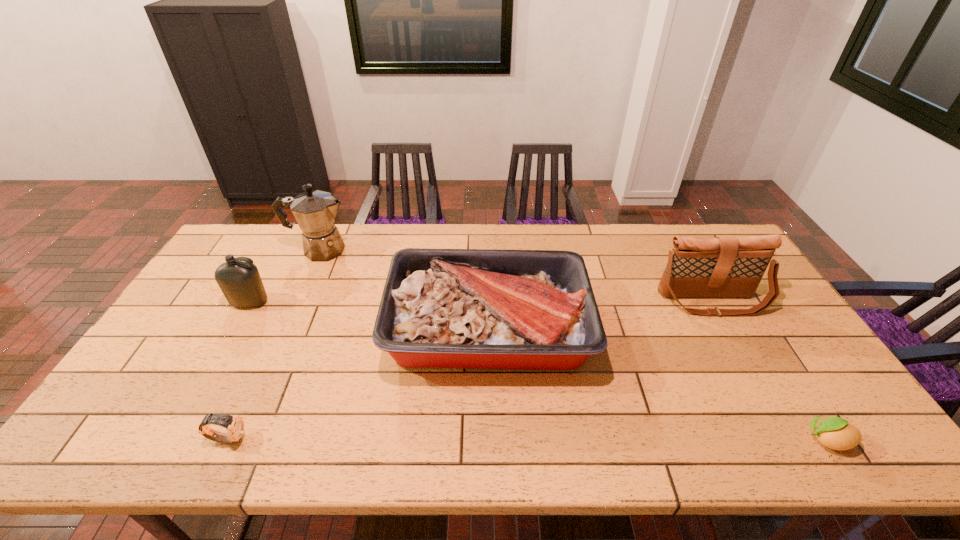
Locate an element on the screen. vacant space located on the face of the watch is located at coordinates (376, 438).

I want to click on vacant space situated 0.120m with leaves positioned above the lemon, so click(751, 440).

The width and height of the screenshot is (960, 540). I want to click on vacant space located 0.280m with leaves positioned above the lemon, so click(681, 440).

The width and height of the screenshot is (960, 540). Identify the location of blank space located 0.270m with leaves positioned above the lemon. (685, 440).

Locate an element on the screen. object located at the far edge is located at coordinates (315, 211).

This screenshot has height=540, width=960. What are the coordinates of `watch positioned at the near edge` in the screenshot? It's located at (235, 425).

You are a GUI agent. You are given a task and a screenshot of the screen. Output one action in this format:
    pyautogui.click(x=<x>, y=<y>)
    Task: Click on the lemon situated at the near edge
    
    Given the screenshot: What is the action you would take?
    pyautogui.click(x=836, y=433)

Identify the location of object that is at the left edge. (240, 282).

The width and height of the screenshot is (960, 540). Find the location of `shoulder bag that is at the right edge`. shoulder bag that is at the right edge is located at coordinates (721, 266).

I want to click on lemon at the right edge, so click(x=836, y=433).